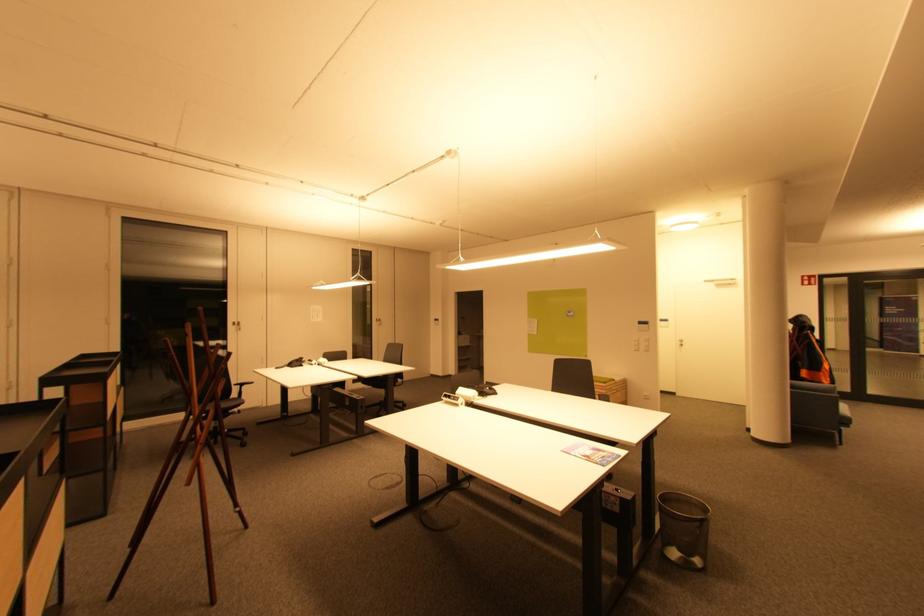
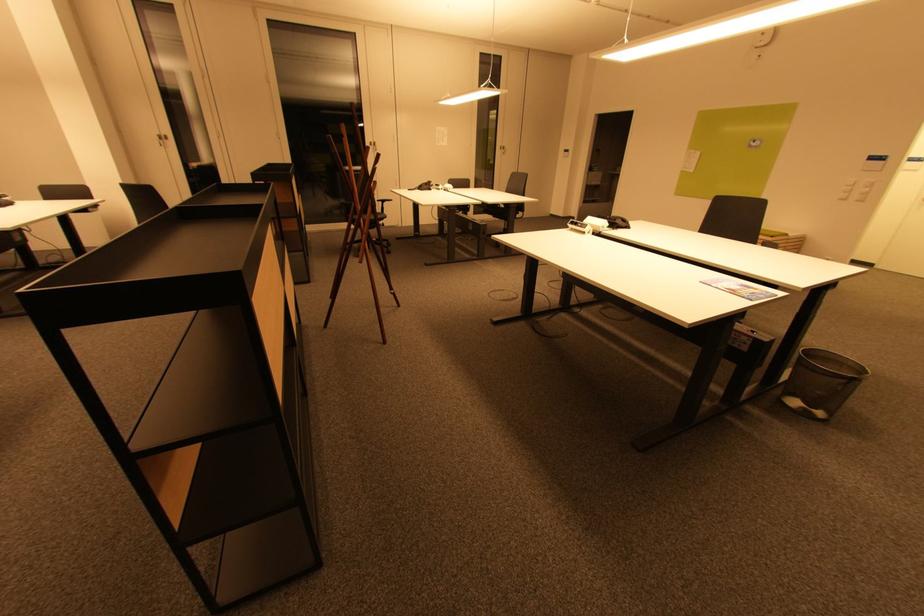
In the second image, find the point that corresponds to pixel 707 522 in the first image.

(859, 381)